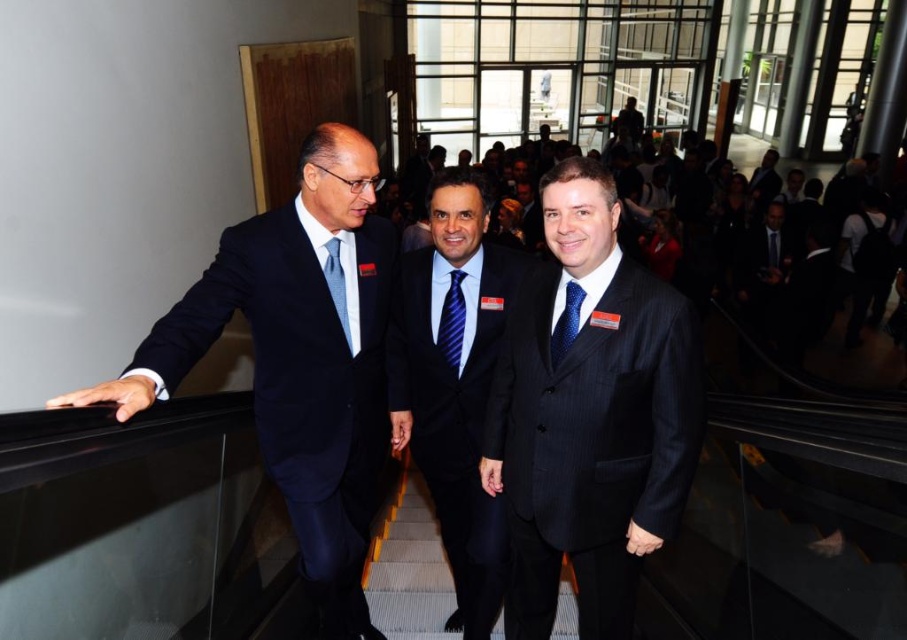
Question: Does blue striped tie at center appear under light blue silk tie at left?

Choices:
 (A) yes
 (B) no

Answer: (A)

Question: Considering the real-world distances, which object is closest to the blue dotted tie at center?

Choices:
 (A) dark pinstripe suit at center
 (B) matte black suit at left
 (C) light blue silk tie at left

Answer: (A)

Question: Which point is closer to the camera?

Choices:
 (A) dark blue suit at upper right
 (B) light blue silk tie at left
 (C) blue dotted tie at center
 (D) dark blue pinstripe suit at center

Answer: (C)

Question: From the image, what is the correct spatial relationship of dark pinstripe suit at center in relation to light blue silk tie at left?

Choices:
 (A) below
 (B) above

Answer: (A)

Question: Where is dark blue pinstripe suit at center located in relation to light blue silk tie at left in the image?

Choices:
 (A) below
 (B) above

Answer: (A)

Question: Considering the real-world distances, which object is closest to the light blue silk tie at left?

Choices:
 (A) dark pinstripe suit at center
 (B) dark blue pinstripe suit at center
 (C) blue silk tie at center

Answer: (B)